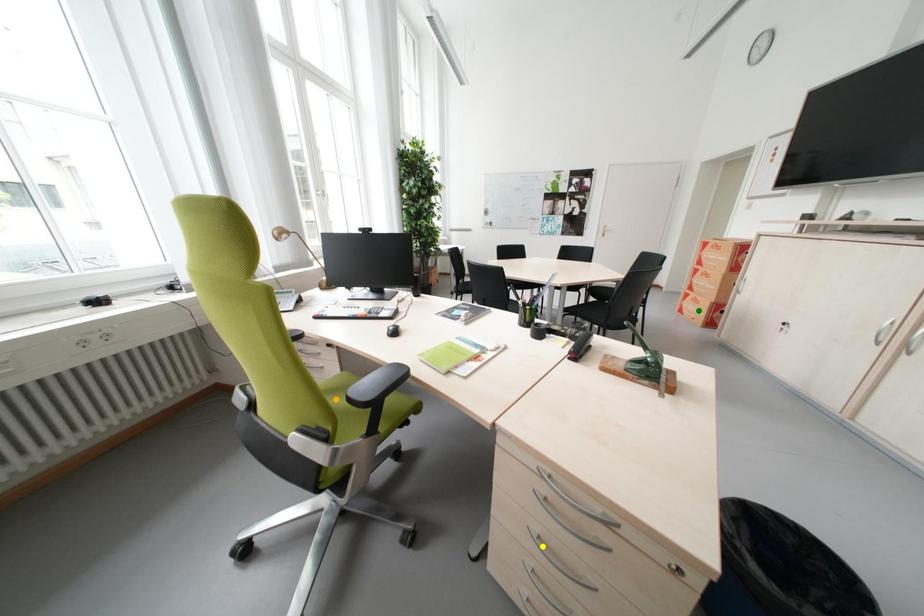
Order these from nearest to farthest:
yellow point, orange point, green point

yellow point < orange point < green point